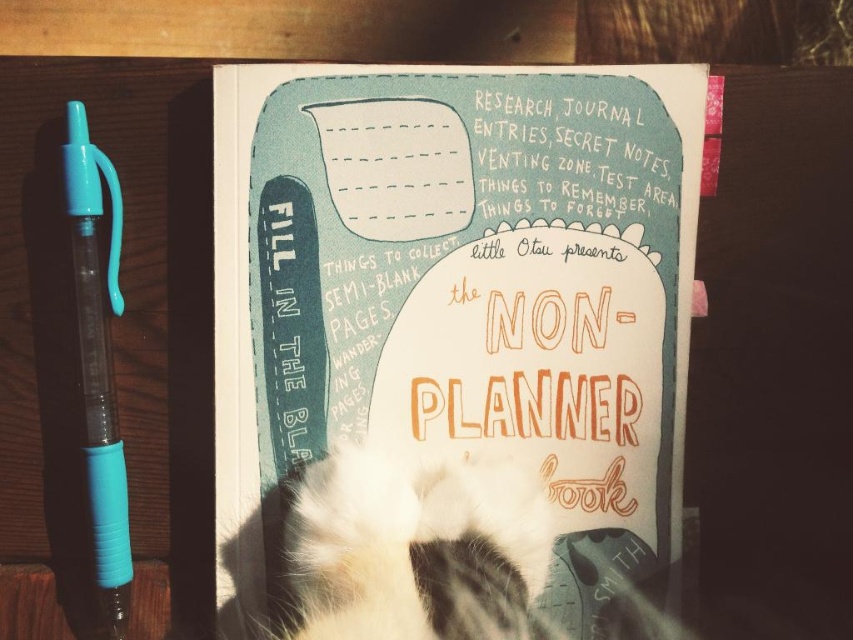
Is point (218, 211) closer to camera compared to point (363, 582)?

No, it is not.

Which is in front, point (392, 145) or point (537, 536)?

Point (537, 536)

Does point (599, 336) lie behind point (425, 561)?

Yes, it is behind point (425, 561).

This screenshot has height=640, width=853. Find the location of `matte paper journal at center`. matte paper journal at center is located at coordinates (457, 294).

Does matte paper journal at center appear over translucent blue plastic pen at left?

Yes.

What do you see at coordinates (457, 294) in the screenshot? I see `matte paper journal at center` at bounding box center [457, 294].

Where is `matte paper journal at center`? Image resolution: width=853 pixels, height=640 pixels. matte paper journal at center is located at coordinates (457, 294).

Is point (486, 509) closer to camera compared to point (86, 371)?

Yes, it is.

Consider the image. Does fluffy white fur at center have a lesser width compared to translucent blue plastic pen at left?

Incorrect, fluffy white fur at center's width is not less than translucent blue plastic pen at left's.

Is point (498, 570) more distant than point (97, 563)?

That is False.

The width and height of the screenshot is (853, 640). Find the location of `fluffy white fur at center`. fluffy white fur at center is located at coordinates (415, 548).